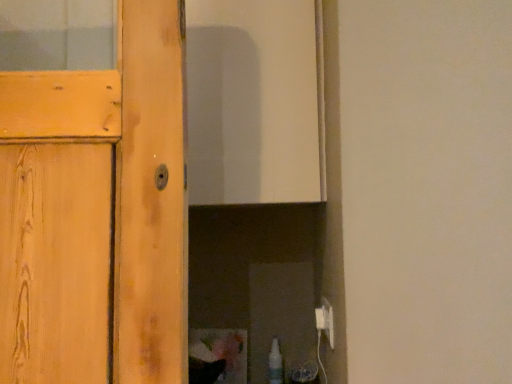
What is the approximate width of white plastic electric outlet at lower right?

0.39 inches.

Image resolution: width=512 pixels, height=384 pixels. Identify the location of white plastic electric outlet at lower right. (325, 320).

What do you see at coordinates (325, 320) in the screenshot? This screenshot has height=384, width=512. I see `white plastic electric outlet at lower right` at bounding box center [325, 320].

Describe the element at coordinates (275, 363) in the screenshot. The height and width of the screenshot is (384, 512). I see `translucent plastic spray bottle at lower right` at that location.

Locate an element on the screen. The height and width of the screenshot is (384, 512). translucent plastic spray bottle at lower right is located at coordinates (275, 363).

Identify the location of white plastic electric outlet at lower right. The width and height of the screenshot is (512, 384). (325, 320).

Considering the positions of objects white plastic electric outlet at lower right and translucent plastic spray bottle at lower right in the image provided, who is more to the left, white plastic electric outlet at lower right or translucent plastic spray bottle at lower right?

translucent plastic spray bottle at lower right is more to the left.

Relative to translucent plastic spray bottle at lower right, is white plastic electric outlet at lower right in front or behind?

Clearly, white plastic electric outlet at lower right is in front of translucent plastic spray bottle at lower right.

Which is closer, [329,329] or [276,339]?

The point [329,329] is more forward.

From the image's perspective, which one is positioned lower, white plastic electric outlet at lower right or translucent plastic spray bottle at lower right?

translucent plastic spray bottle at lower right appears lower in the image.

From a real-world perspective, is white plastic electric outlet at lower right physically located above or below translucent plastic spray bottle at lower right?

From a real-world perspective, white plastic electric outlet at lower right is physically above translucent plastic spray bottle at lower right.

In terms of width, does white plastic electric outlet at lower right look wider or thinner when compared to translucent plastic spray bottle at lower right?

Clearly, white plastic electric outlet at lower right has less width compared to translucent plastic spray bottle at lower right.

Is white plastic electric outlet at lower right taller than translucent plastic spray bottle at lower right?

No, white plastic electric outlet at lower right is not taller than translucent plastic spray bottle at lower right.

Does white plastic electric outlet at lower right have a smaller size compared to translucent plastic spray bottle at lower right?

Indeed, white plastic electric outlet at lower right has a smaller size compared to translucent plastic spray bottle at lower right.

Is translucent plastic spray bottle at lower right inside white plastic electric outlet at lower right?

Definitely not — translucent plastic spray bottle at lower right is not inside white plastic electric outlet at lower right.

From the picture: Would you say white plastic electric outlet at lower right is a long distance from translucent plastic spray bottle at lower right?

white plastic electric outlet at lower right is near translucent plastic spray bottle at lower right, not far away.

Is white plastic electric outlet at lower right oriented away from translucent plastic spray bottle at lower right?

No, white plastic electric outlet at lower right is not facing the opposite direction of translucent plastic spray bottle at lower right.

How many degrees apart are the facing directions of white plastic electric outlet at lower right and translucent plastic spray bottle at lower right?

There is a 91.8-degree angle between the facing directions of white plastic electric outlet at lower right and translucent plastic spray bottle at lower right.

Image resolution: width=512 pixels, height=384 pixels. Find the location of `electric outlet in front of the translucent plastic spray bottle at lower right`. electric outlet in front of the translucent plastic spray bottle at lower right is located at coordinates (325, 320).

Considering the positions of objects translucent plastic spray bottle at lower right and white plastic electric outlet at lower right in the image provided, who is more to the left, translucent plastic spray bottle at lower right or white plastic electric outlet at lower right?

From the viewer's perspective, translucent plastic spray bottle at lower right appears more on the left side.

Is translucent plastic spray bottle at lower right positioned before white plastic electric outlet at lower right?

No, it is behind white plastic electric outlet at lower right.

Is point (272, 364) positioned in front of point (320, 309)?

No.

From the image's perspective, is translucent plastic spray bottle at lower right positioned above or below white plastic electric outlet at lower right?

Based on their image positions, translucent plastic spray bottle at lower right is located beneath white plastic electric outlet at lower right.

From a real-world perspective, is translucent plastic spray bottle at lower right positioned above or below white plastic electric outlet at lower right?

From a real-world perspective, translucent plastic spray bottle at lower right is physically below white plastic electric outlet at lower right.

Considering the sizes of objects translucent plastic spray bottle at lower right and white plastic electric outlet at lower right in the image provided, who is thinner, translucent plastic spray bottle at lower right or white plastic electric outlet at lower right?

Thinner between the two is white plastic electric outlet at lower right.

In terms of height, does translucent plastic spray bottle at lower right look taller or shorter compared to white plastic electric outlet at lower right?

Considering their sizes, translucent plastic spray bottle at lower right has more height than white plastic electric outlet at lower right.

Between translucent plastic spray bottle at lower right and white plastic electric outlet at lower right, which one has smaller size?

Smaller between the two is white plastic electric outlet at lower right.

Would you say translucent plastic spray bottle at lower right is outside white plastic electric outlet at lower right?

translucent plastic spray bottle at lower right is positioned outside white plastic electric outlet at lower right.

Are translucent plastic spray bottle at lower right and white plastic electric outlet at lower right beside each other?

translucent plastic spray bottle at lower right and white plastic electric outlet at lower right are clearly separated.

Is translucent plastic spray bottle at lower right facing towards white plastic electric outlet at lower right?

No, translucent plastic spray bottle at lower right is not facing towards white plastic electric outlet at lower right.

Where is `electric outlet above the translucent plastic spray bottle at lower right (from a real-world perspective)`? electric outlet above the translucent plastic spray bottle at lower right (from a real-world perspective) is located at coordinates (325, 320).

The height and width of the screenshot is (384, 512). In order to click on electric outlet in front of the translucent plastic spray bottle at lower right in this screenshot , I will do `click(325, 320)`.

I want to click on bottle below the white plastic electric outlet at lower right (from a real-world perspective), so click(275, 363).